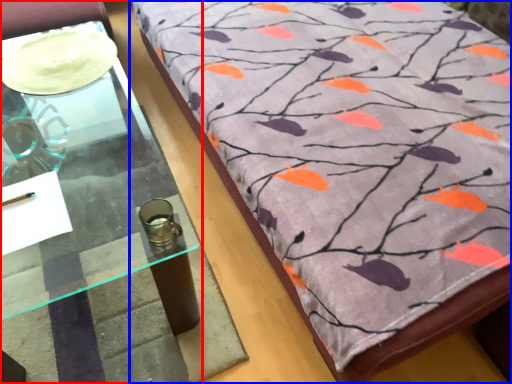
Question: Among these objects, which one is farthest to the camera, table (highlighted by a red box) or furniture (highlighted by a blue box)?

Choices:
 (A) table
 (B) furniture

Answer: (A)